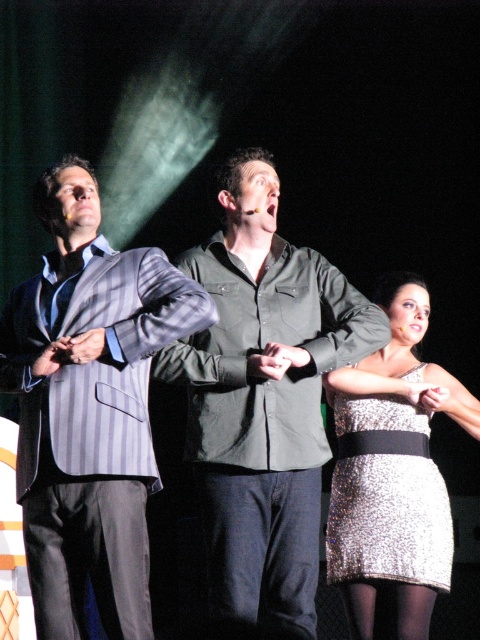
Is gray striped suit at left to the right of matte green shirt at center from the viewer's perspective?

In fact, gray striped suit at left is to the left of matte green shirt at center.

Is gray striped suit at left shorter than matte green shirt at center?

Yes.

Does point (108, 634) come behind point (277, 547)?

No.

Locate an element on the screen. This screenshot has height=640, width=480. gray striped suit at left is located at coordinates (88, 406).

Can you confirm if gray striped suit at left is positioned to the left of sparkly silver dress at center?

Indeed, gray striped suit at left is positioned on the left side of sparkly silver dress at center.

Can you confirm if gray striped suit at left is bigger than sparkly silver dress at center?

Indeed, gray striped suit at left has a larger size compared to sparkly silver dress at center.

Between point (72, 317) and point (348, 529), which one is positioned in front?

Point (72, 317)

Locate an element on the screen. The width and height of the screenshot is (480, 640). gray striped suit at left is located at coordinates (88, 406).

How far apart are matte green shirt at center and sparkly silver dress at center?

The distance of matte green shirt at center from sparkly silver dress at center is 24.35 inches.

Does matte green shirt at center have a lesser width compared to sparkly silver dress at center?

No, matte green shirt at center is not thinner than sparkly silver dress at center.

Is point (253, 160) more distant than point (391, 465)?

No, it is in front of (391, 465).

In order to click on matte green shirt at center in this screenshot , I will do `click(263, 403)`.